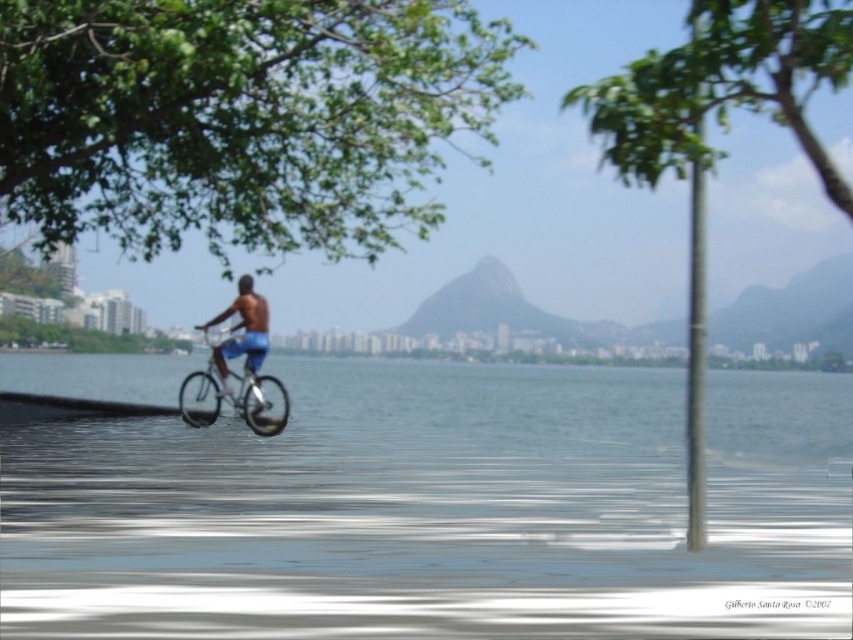
You are a photographer trying to capture the blue fabric shorts at center and the green leafy tree at upper center in a single shot. Which object will appear wider in the photo?

The green leafy tree at upper center will appear wider in the photo because its width surpasses that of the blue fabric shorts at center.

You are a city planner assessing the safety of the bicycle path. The green leafy tree at upper center is located 8.89 meters away from the blue fabric shorts at center. Considering the tree might need trimming for safety, would you recommend trimming the tree branches to ensure they don not interfere with cyclists?

The green leafy tree at upper center is 8.89 meters away from the blue fabric shorts at center. This distance suggests that the branches might still overhang into the path, so trimming may be necessary to ensure cyclist safety.